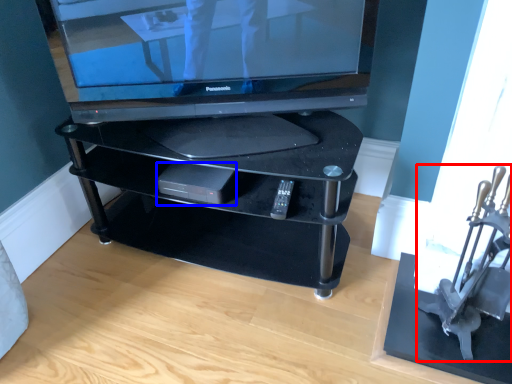
Question: Which object is closer to the camera taking this photo, armchair (highlighted by a red box) or gadget (highlighted by a blue box)?

Choices:
 (A) armchair
 (B) gadget

Answer: (A)